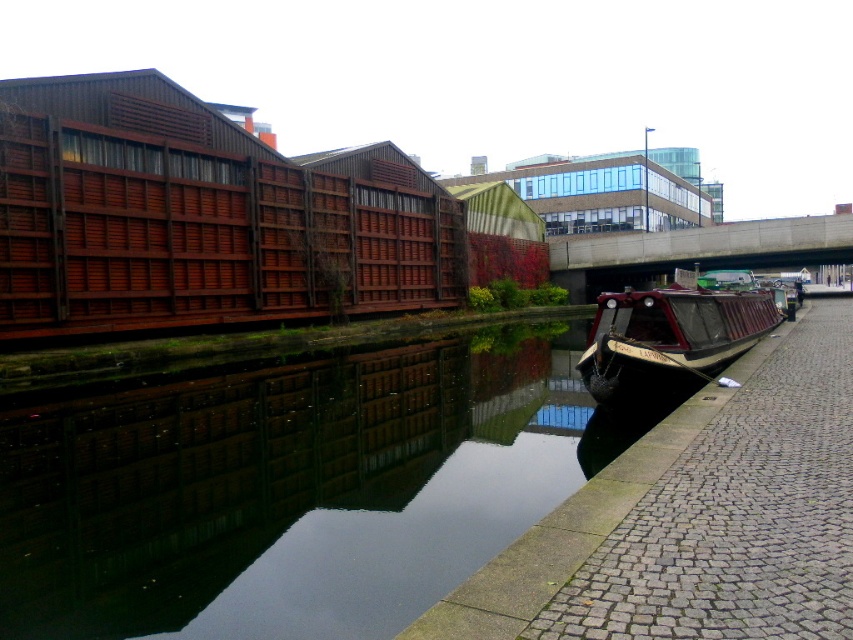
Is the position of black reflective water at lower center less distant than that of wooden polished barge at right?

Yes, it is in front of wooden polished barge at right.

Is black reflective water at lower center thinner than wooden polished barge at right?

Correct, black reflective water at lower center's width is less than wooden polished barge at right's.

Is point (44, 579) positioned in front of point (601, 314)?

Yes, it is in front of point (601, 314).

Find the location of a particular element. The image size is (853, 640). black reflective water at lower center is located at coordinates (292, 490).